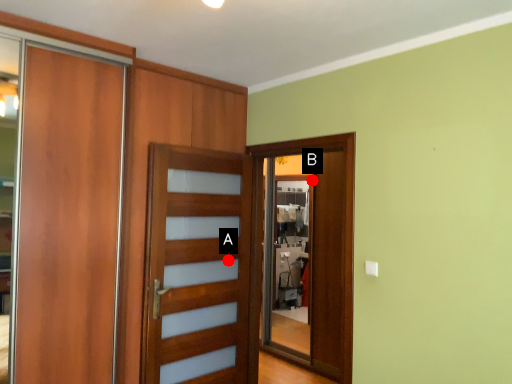
Question: Two points are circled on the image, labeled by A and B beside each circle. Which point is closer to the camera taking this photo?

Choices:
 (A) A is closer
 (B) B is closer

Answer: (A)